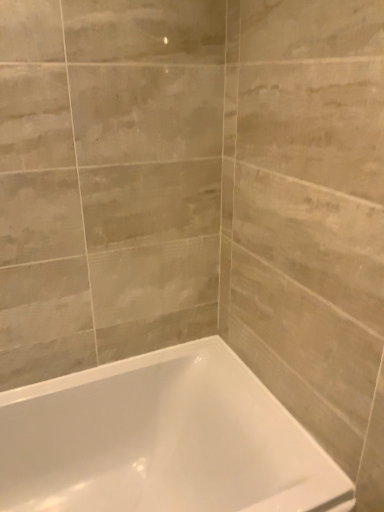
What do you see at coordinates (162, 440) in the screenshot? I see `white glossy bathtub at lower left` at bounding box center [162, 440].

The height and width of the screenshot is (512, 384). Identify the location of white glossy bathtub at lower left. (162, 440).

Where is `white glossy bathtub at lower left`? This screenshot has width=384, height=512. white glossy bathtub at lower left is located at coordinates (162, 440).